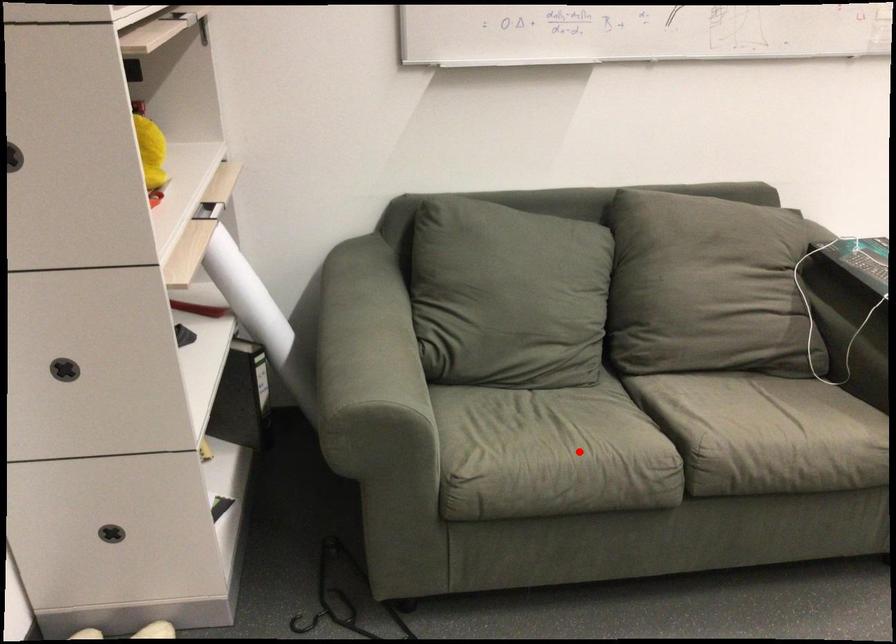
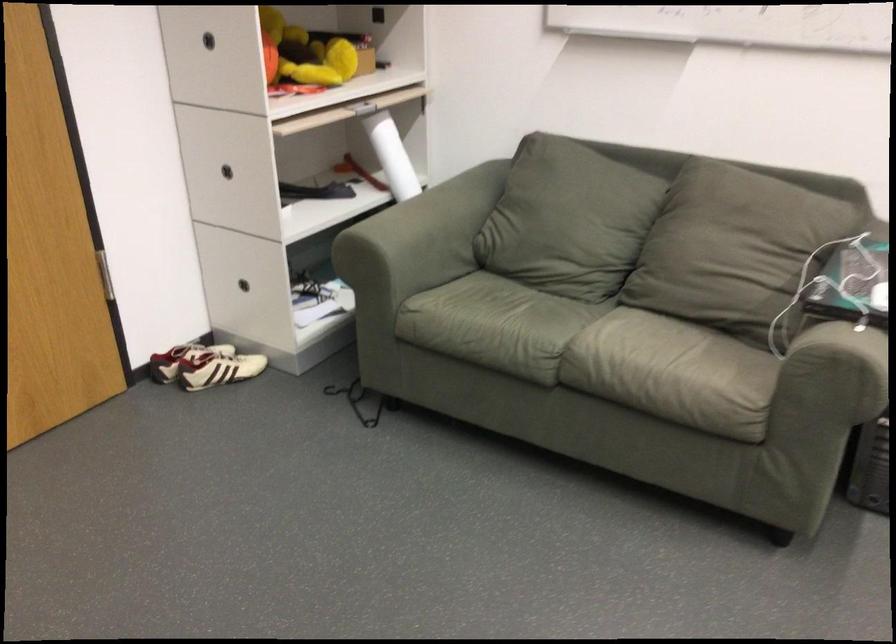
In the second image, find the point that corresponds to the highlighted location in the first image.

(495, 325)